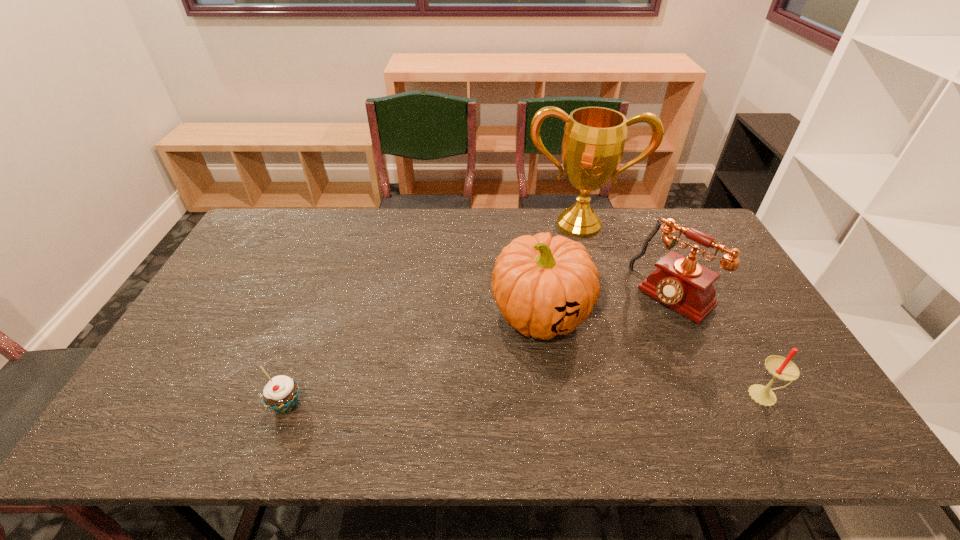
Image resolution: width=960 pixels, height=540 pixels. Find the location of `free space on the desktop that is between the shortest object and the fourth tallest object and is positioned on the dial of the telephone`. free space on the desktop that is between the shortest object and the fourth tallest object and is positioned on the dial of the telephone is located at coordinates (559, 400).

Find the location of a particular element. Image resolution: width=960 pixels, height=540 pixels. free space on the desktop that is between the shortest object and the fourth tallest object and is positioned on the surface of the pumpkin is located at coordinates (490, 401).

Image resolution: width=960 pixels, height=540 pixels. In order to click on vacant space on the desktop that is between the cupcake and the second shortest object and is positioned on the front-facing side of the farthest object in this screenshot , I will do `click(579, 399)`.